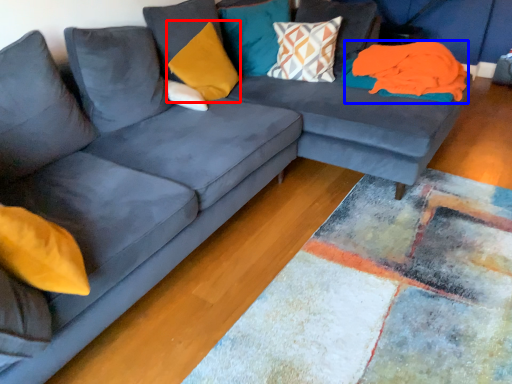
Question: Which object appears farthest to the camera in this image, pillow (highlighted by a red box) or material (highlighted by a blue box)?

Choices:
 (A) pillow
 (B) material

Answer: (B)